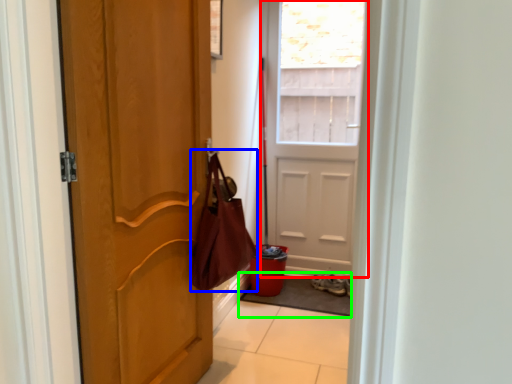
Question: Estimate the real-world distances between objects in this image. Which object is closer to door (highlighted by a red box), shoulder bag (highlighted by a blue box) or doormat (highlighted by a green box)?

Choices:
 (A) shoulder bag
 (B) doormat

Answer: (B)